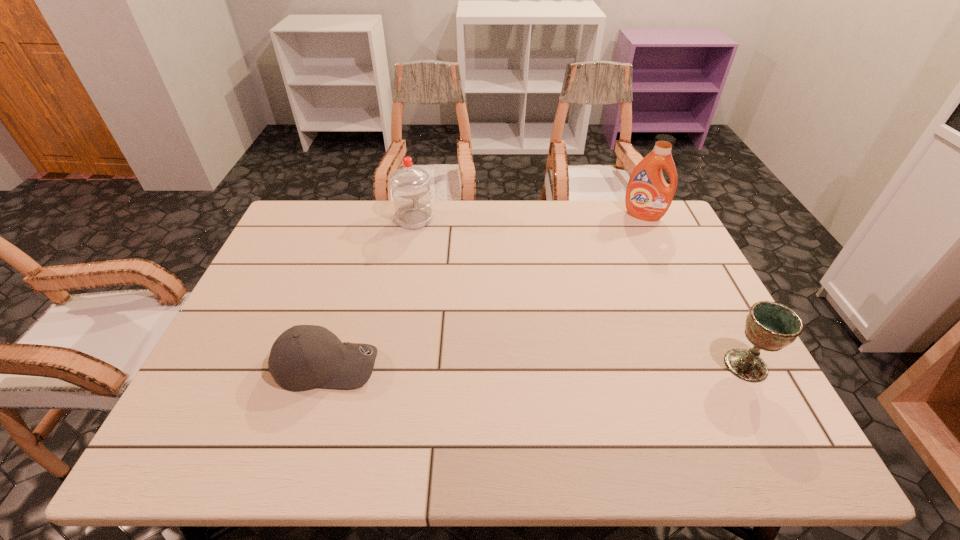
Find the location of a particular element. The image size is (960, 540). blank region between the detergent and the water bottle is located at coordinates (529, 217).

Locate an element on the screen. The width and height of the screenshot is (960, 540). free point between the water bottle and the third tallest object is located at coordinates (580, 292).

This screenshot has height=540, width=960. Identify the location of empty space between the second shortest object and the water bottle. (580, 292).

Image resolution: width=960 pixels, height=540 pixels. Find the location of `unoccupied position between the shortest object and the chalice`. unoccupied position between the shortest object and the chalice is located at coordinates (536, 365).

Identify the location of unoccupied area between the baseball cap and the tallest object. (485, 290).

Where is `vacant area that lies between the shortest object and the detergent`? This screenshot has width=960, height=540. vacant area that lies between the shortest object and the detergent is located at coordinates (485, 290).

The height and width of the screenshot is (540, 960). In order to click on vacant area that lies between the chalice and the shortest object in this screenshot , I will do `click(536, 365)`.

The height and width of the screenshot is (540, 960). Identify the location of free spot between the shortest object and the third shortest object. (371, 292).

Find the location of a particular element. Image resolution: width=960 pixels, height=540 pixels. object that can be found as the third closest to the second shortest object is located at coordinates click(411, 193).

Find the location of a particular element. The image size is (960, 540). object that is the second nearest to the chalice is located at coordinates (304, 357).